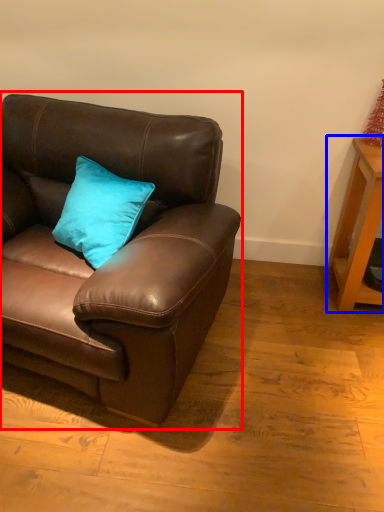
Question: Which object is further to the camera taking this photo, studio couch (highlighted by a red box) or table (highlighted by a blue box)?

Choices:
 (A) studio couch
 (B) table

Answer: (B)